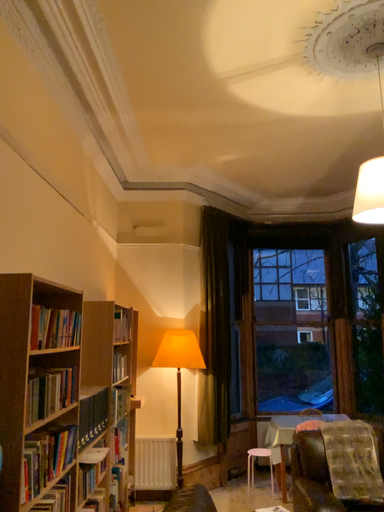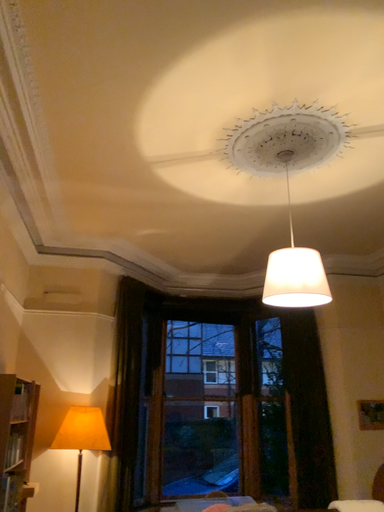
Question: Which way did the camera rotate in the video?

Choices:
 (A) rotated left
 (B) rotated right

Answer: (B)